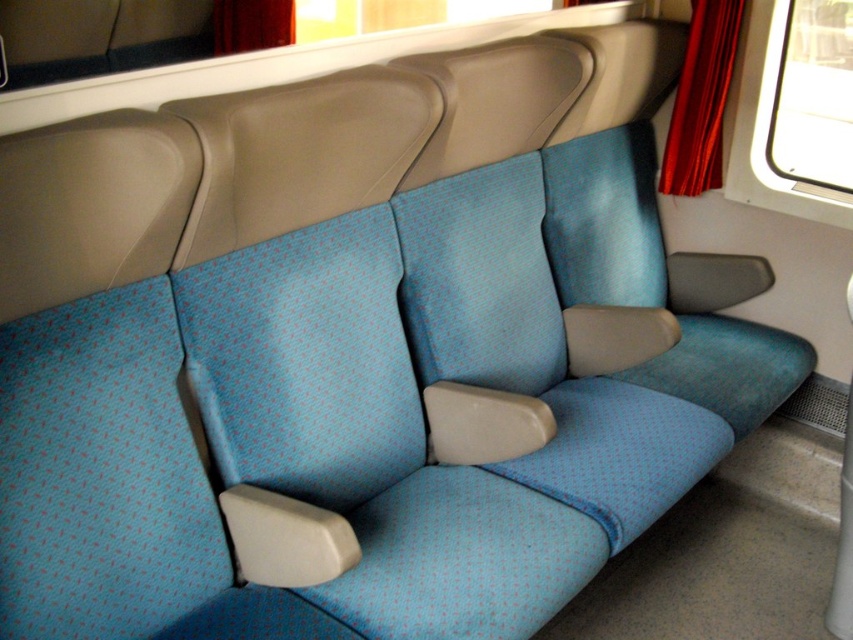
Who is more forward, (x=808, y=42) or (x=682, y=134)?

Point (x=682, y=134)

Between point (825, 33) and point (711, 12), which one is positioned in front?

Point (711, 12) is in front.

Where is `transparent glass window at upper right`? transparent glass window at upper right is located at coordinates (810, 93).

Does point (700, 193) come behind point (236, 32)?

No.

Which is behind, point (683, 96) or point (231, 20)?

Positioned behind is point (231, 20).

Is point (701, 88) farther from viewer compared to point (287, 1)?

No, it is not.

Image resolution: width=853 pixels, height=640 pixels. I want to click on velvet red curtain at upper right, so click(701, 99).

Can you confirm if transparent glass window at upper right is positioned above red velvet curtain at upper center?

No, transparent glass window at upper right is not above red velvet curtain at upper center.

Does transparent glass window at upper right have a smaller size compared to red velvet curtain at upper center?

No, transparent glass window at upper right is not smaller than red velvet curtain at upper center.

Describe the element at coordinates (810, 93) in the screenshot. I see `transparent glass window at upper right` at that location.

Find the location of a particular element. The height and width of the screenshot is (640, 853). transparent glass window at upper right is located at coordinates (810, 93).